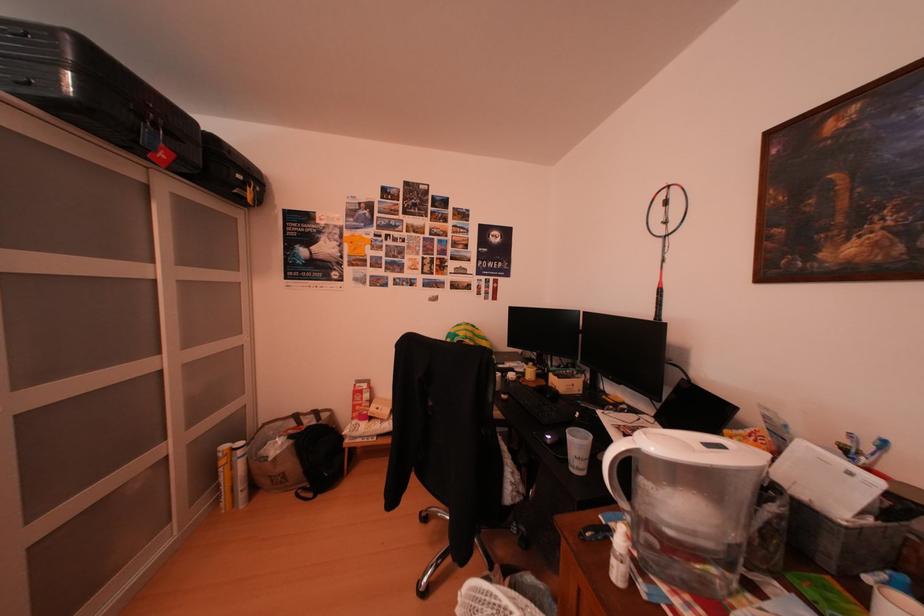
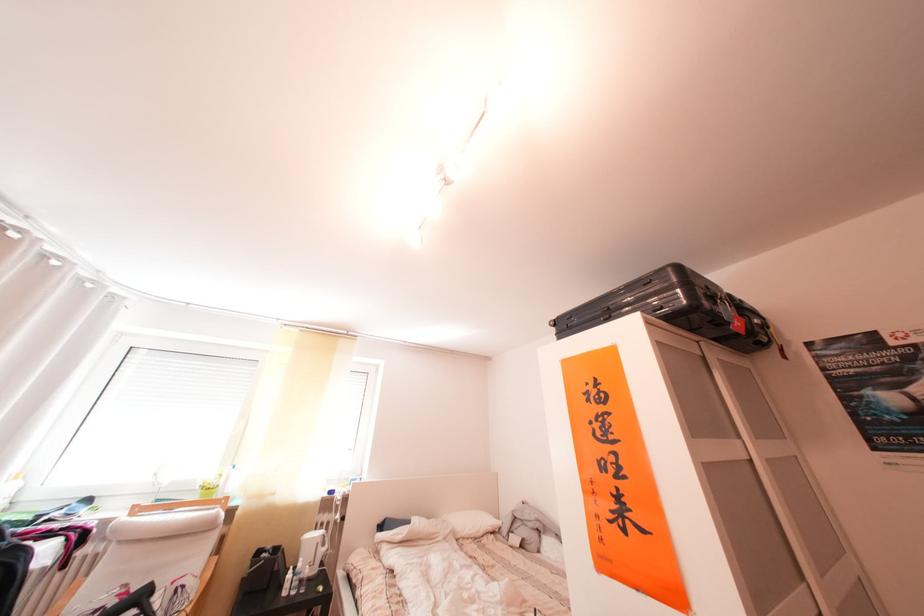
Locate, in the second image, the point that corresponds to (x=166, y=267) in the first image.

(751, 442)